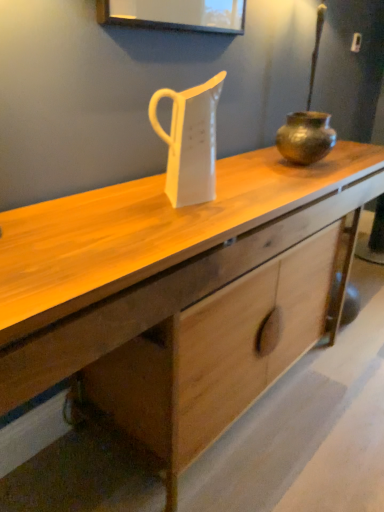
The image size is (384, 512). I want to click on free spot in front of white glossy jug at center, so click(x=175, y=217).